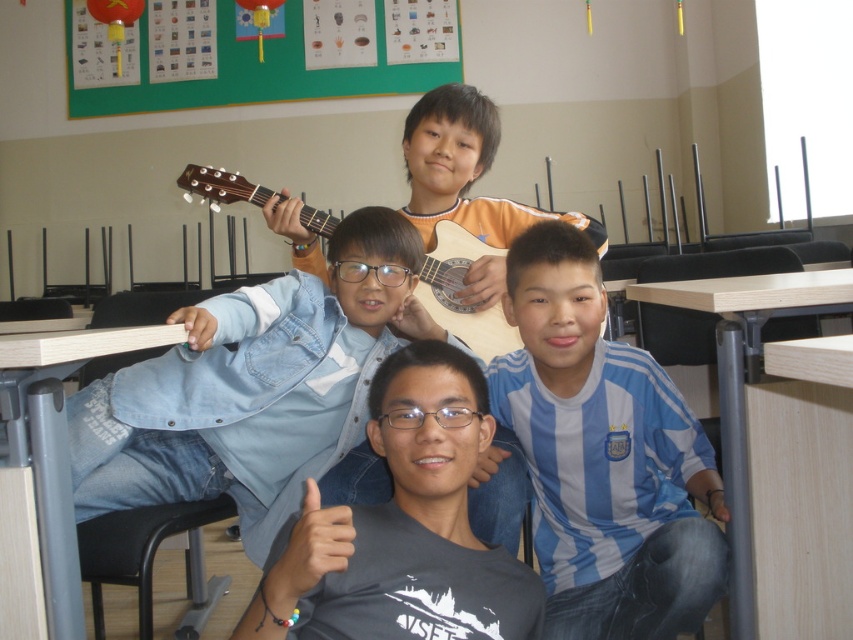
Is blue striped jersey at center to the left of acoustic wood guitar at center from the viewer's perspective?

Incorrect, blue striped jersey at center is not on the left side of acoustic wood guitar at center.

The width and height of the screenshot is (853, 640). Identify the location of blue striped jersey at center. (602, 456).

Image resolution: width=853 pixels, height=640 pixels. In order to click on blue striped jersey at center in this screenshot , I will do 602,456.

Can you confirm if blue striped jersey at center is positioned to the left of gray matte t-shirt at center?

Incorrect, blue striped jersey at center is not on the left side of gray matte t-shirt at center.

Is blue striped jersey at center smaller than gray matte t-shirt at center?

No, blue striped jersey at center is not smaller than gray matte t-shirt at center.

Between point (683, 589) and point (312, 596), which one is positioned behind?

The point (683, 589) is behind.

Where is `blue striped jersey at center`? The width and height of the screenshot is (853, 640). blue striped jersey at center is located at coordinates (602, 456).

Can you confirm if blue striped jersey at center is bigger than denim jacket at center?

No.

Who is positioned more to the left, blue striped jersey at center or denim jacket at center?

Positioned to the left is denim jacket at center.

Is point (532, 428) more distant than point (426, 131)?

That is False.

In order to click on blue striped jersey at center in this screenshot , I will do `click(602, 456)`.